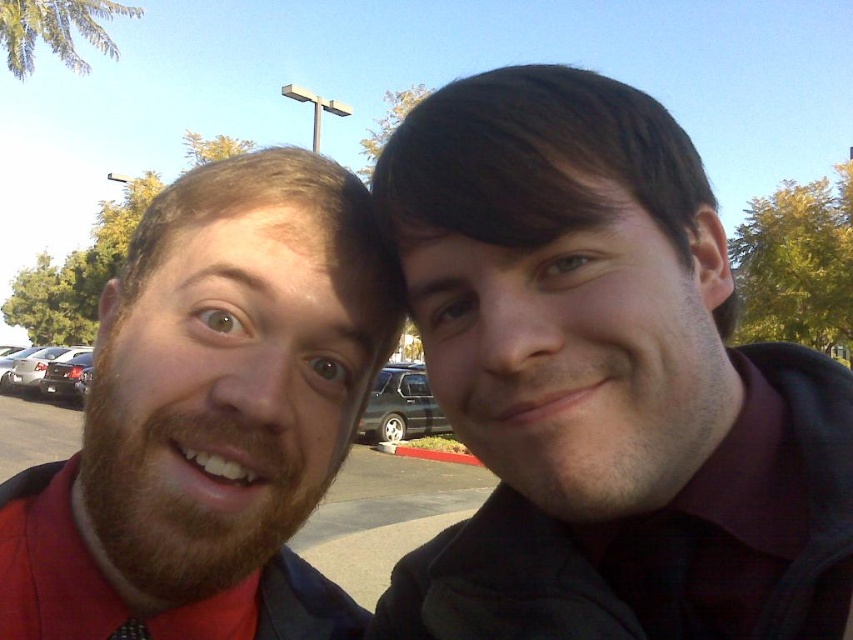
Based on the photo, can you confirm if matte black jacket at upper right is positioned to the right of silver metallic sedan at left?

Yes, matte black jacket at upper right is to the right of silver metallic sedan at left.

Who is positioned more to the right, matte black jacket at upper right or silver metallic sedan at left?

matte black jacket at upper right is more to the right.

Where is `matte black jacket at upper right`? The image size is (853, 640). matte black jacket at upper right is located at coordinates (604, 381).

Does silver metallic sedan at left have a smaller size compared to black satin tie at lower left?

No, silver metallic sedan at left is not smaller than black satin tie at lower left.

Does silver metallic sedan at left have a lesser width compared to black satin tie at lower left?

No.

Is point (57, 346) farther from viewer compared to point (140, 634)?

Yes, point (57, 346) is behind point (140, 634).

Find the location of a particular element. The image size is (853, 640). silver metallic sedan at left is located at coordinates tap(36, 365).

Does matte black jacket at upper right have a greater width compared to shiny black suv at center?

In fact, matte black jacket at upper right might be narrower than shiny black suv at center.

I want to click on matte black jacket at upper right, so click(604, 381).

Image resolution: width=853 pixels, height=640 pixels. I want to click on matte black jacket at upper right, so click(x=604, y=381).

Locate an element on the screen. matte black jacket at upper right is located at coordinates (604, 381).